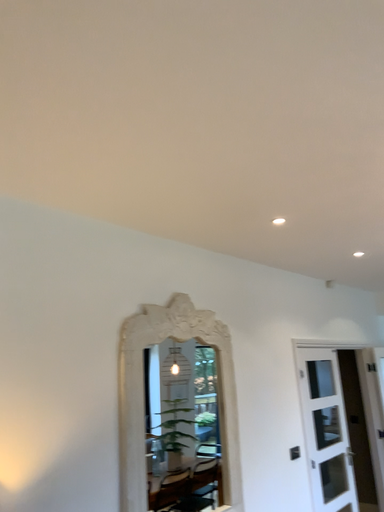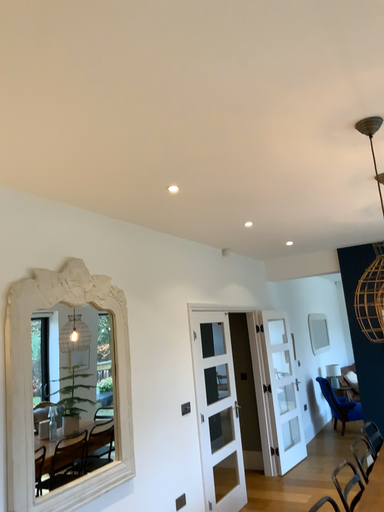
Question: How did the camera likely rotate when shooting the video?

Choices:
 (A) rotated left
 (B) rotated right

Answer: (B)